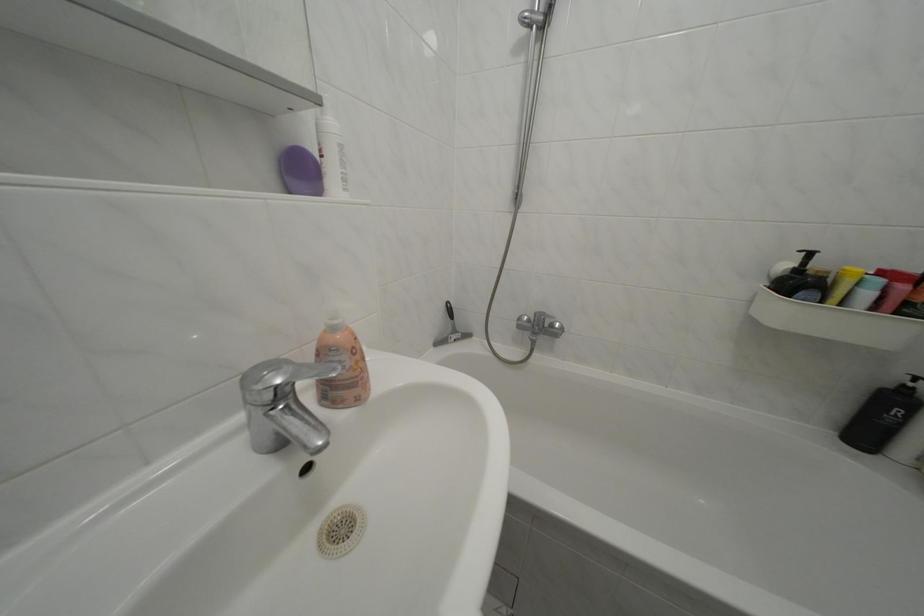
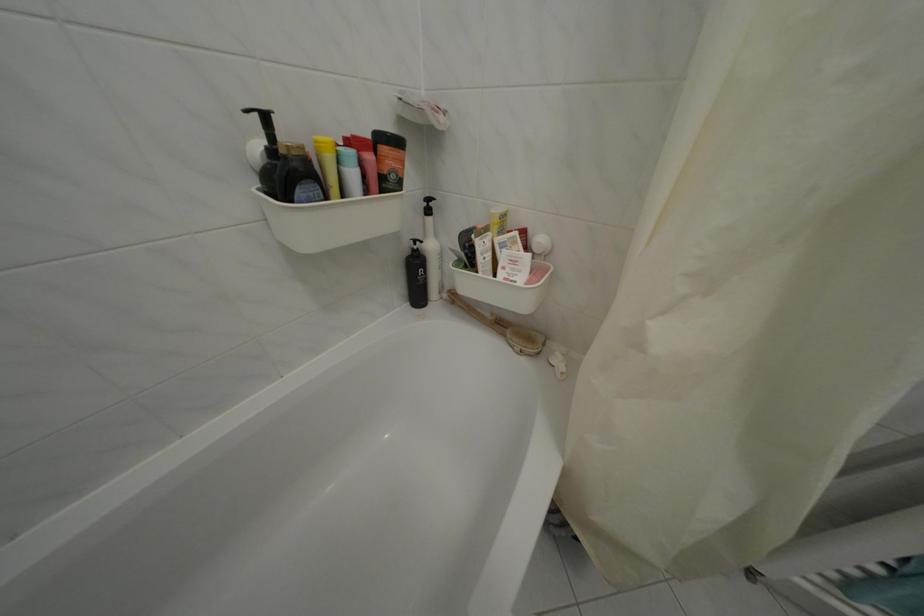
Where in the second image is the point corresponding to point 796,280 from the first image?

(274, 166)